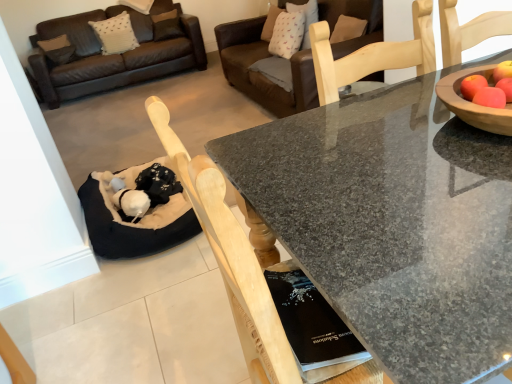
Question: Is brown leather couch at upper center oriented away from black fabric cat bed at lower left?

Choices:
 (A) yes
 (B) no

Answer: (B)

Question: Does brown leather couch at upper center turn towards black fabric cat bed at lower left?

Choices:
 (A) no
 (B) yes

Answer: (B)

Question: Does brown leather couch at upper center have a smaller size compared to black fabric cat bed at lower left?

Choices:
 (A) no
 (B) yes

Answer: (A)

Question: Does brown leather couch at upper center come behind black fabric cat bed at lower left?

Choices:
 (A) yes
 (B) no

Answer: (A)

Question: From the image's perspective, is brown leather couch at upper center under black fabric cat bed at lower left?

Choices:
 (A) no
 (B) yes

Answer: (A)

Question: Based on their positions, is brown leather couch at upper center located to the left or right of granite table at center?

Choices:
 (A) left
 (B) right

Answer: (A)

Question: Looking at their shapes, would you say brown leather couch at upper center is wider or thinner than granite table at center?

Choices:
 (A) wide
 (B) thin

Answer: (B)

Question: In terms of height, does brown leather couch at upper center look taller or shorter compared to granite table at center?

Choices:
 (A) short
 (B) tall

Answer: (B)

Question: From a real-world perspective, is brown leather couch at upper center positioned above or below granite table at center?

Choices:
 (A) above
 (B) below

Answer: (A)

Question: Which is correct: granite table at center is inside brown leather couch at upper center, or outside of it?

Choices:
 (A) inside
 (B) outside

Answer: (B)

Question: From their relative heights in the image, would you say granite table at center is taller or shorter than brown leather couch at upper center?

Choices:
 (A) tall
 (B) short

Answer: (B)

Question: Looking at the image, does granite table at center seem bigger or smaller compared to brown leather couch at upper center?

Choices:
 (A) small
 (B) big

Answer: (A)

Question: Would you say granite table at center is to the left or to the right of brown leather couch at upper center in the picture?

Choices:
 (A) left
 (B) right

Answer: (B)

Question: Would you say brown leather couch at upper center is to the left or to the right of black fabric cat bed at lower left in the picture?

Choices:
 (A) left
 (B) right

Answer: (B)

Question: From the image's perspective, is brown leather couch at upper center located above or below black fabric cat bed at lower left?

Choices:
 (A) above
 (B) below

Answer: (A)